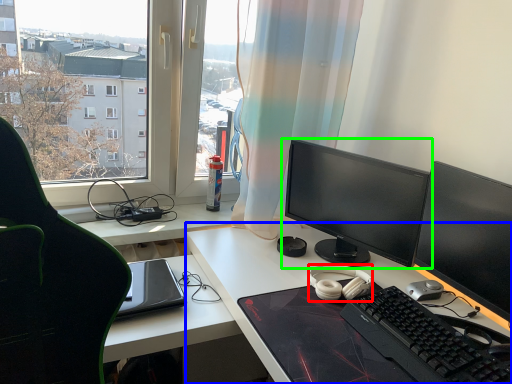
Question: Which object is the farthest from headphones (highlighted by a red box)? Choose among these: desk (highlighted by a blue box) or computer monitor (highlighted by a green box).

Choices:
 (A) desk
 (B) computer monitor

Answer: (B)